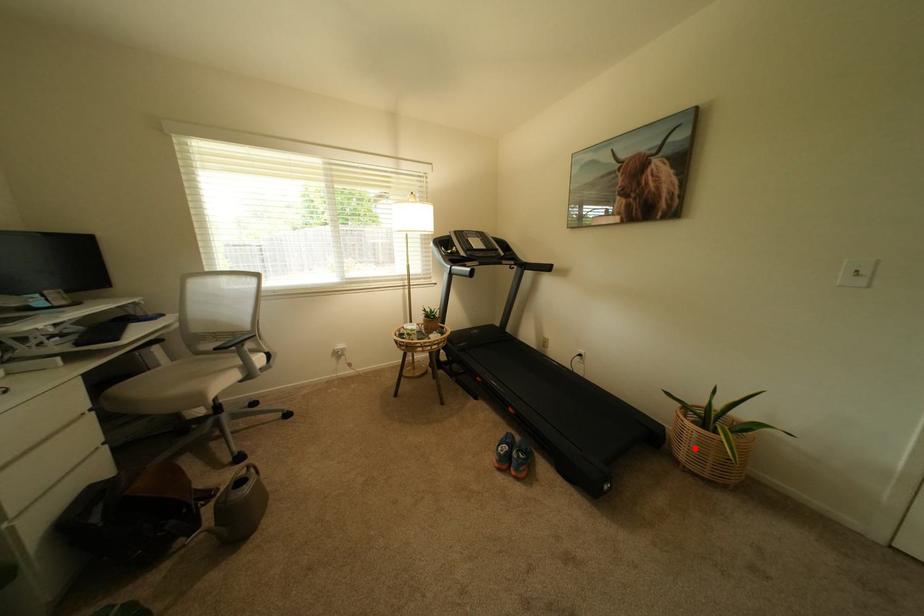
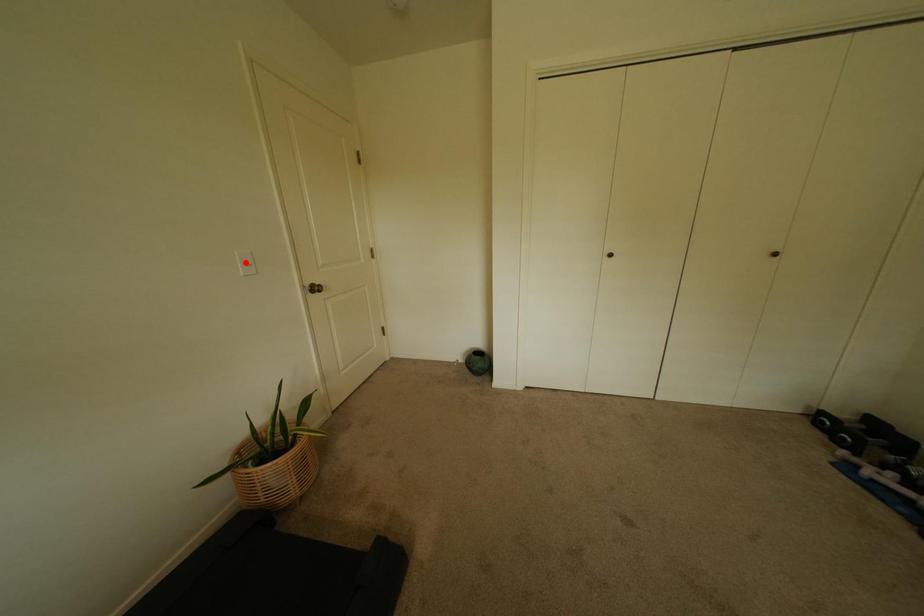
I am providing you with two images of the same scene from different viewpoints. A red point is marked on the first image and another point is marked on the second image. Is the red point in image1 aligned with the point shown in image2?

No